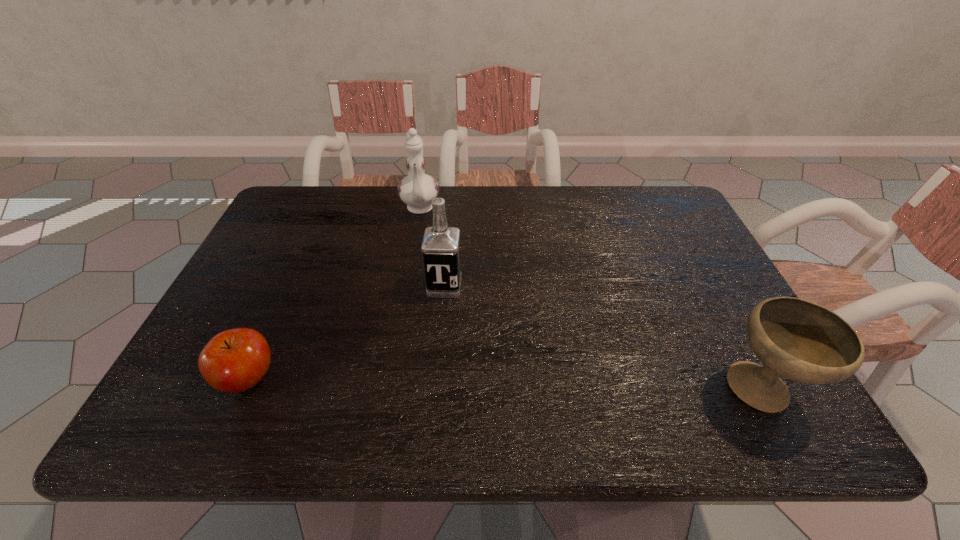
Where is `empty location between the shortest object and the rightmost object`? empty location between the shortest object and the rightmost object is located at coordinates (505, 385).

Image resolution: width=960 pixels, height=540 pixels. I want to click on vacant area that lies between the chalice and the farthest object, so click(x=590, y=300).

This screenshot has height=540, width=960. Identify the location of blank region between the rightmost object and the second farthest object. (603, 339).

Find the location of a particular element. This screenshot has height=540, width=960. unoccupied area between the chinaware and the second shortest object is located at coordinates coord(590,300).

Identify the location of vacant space that is in between the shortest object and the chinaware. This screenshot has height=540, width=960. (334, 294).

Identify which object is the third closest to the farthest object. Please provide its 2D coordinates. Your answer should be formatted as a tuple, i.e. [(x, y)], where the tuple contains the x and y coordinates of a point satisfying the conditions above.

[(797, 339)]

This screenshot has width=960, height=540. What are the coordinates of `the closest object to the chalice` in the screenshot? It's located at (441, 251).

I want to click on blank area in the image that satisfies the following two spatial constraints: 1. on the front side of the shortest object; 2. on the left side of the rightmost object, so click(243, 391).

I want to click on free spot that satisfies the following two spatial constraints: 1. on the front side of the shortest object; 2. on the left side of the rightmost object, so click(243, 391).

I want to click on free space in the image that satisfies the following two spatial constraints: 1. on the front side of the second farthest object; 2. on the left side of the rightmost object, so click(x=436, y=391).